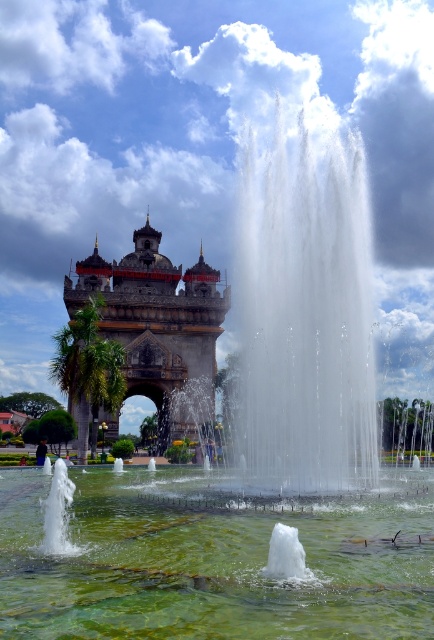
Does green translucent water at center appear under polished stone arch at center?

Yes, green translucent water at center is below polished stone arch at center.

Can you confirm if green translucent water at center is positioned to the left of polished stone arch at center?

In fact, green translucent water at center is to the right of polished stone arch at center.

Is point (249, 557) in front of point (180, 330)?

Yes, it is.

Where is `green translucent water at center`? The height and width of the screenshot is (640, 434). green translucent water at center is located at coordinates (211, 560).